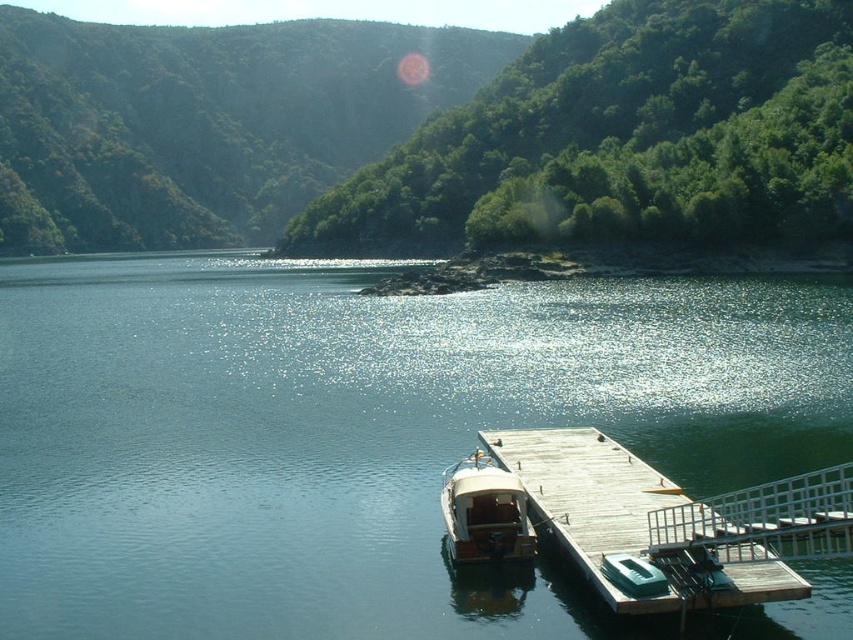
Does wooden dock at lower right appear on the right side of wooden polished boat at center?

Correct, you'll find wooden dock at lower right to the right of wooden polished boat at center.

Does wooden dock at lower right have a lesser height compared to wooden polished boat at center?

No, wooden dock at lower right is not shorter than wooden polished boat at center.

This screenshot has width=853, height=640. I want to click on wooden dock at lower right, so click(618, 518).

Is clear blue water at center further to camera compared to wooden polished boat at center?

That is False.

Is clear blue water at center wider than wooden polished boat at center?

Yes.

The width and height of the screenshot is (853, 640). What do you see at coordinates (358, 433) in the screenshot?
I see `clear blue water at center` at bounding box center [358, 433].

This screenshot has width=853, height=640. Identify the location of clear blue water at center. (358, 433).

Is point (527, 406) closer to camera compared to point (639, 506)?

That is False.

Is the position of clear blue water at center more distant than that of wooden dock at lower right?

Yes, it is behind wooden dock at lower right.

Between point (173, 372) and point (605, 522), which one is positioned in front?

Point (605, 522)

I want to click on clear blue water at center, so click(x=358, y=433).